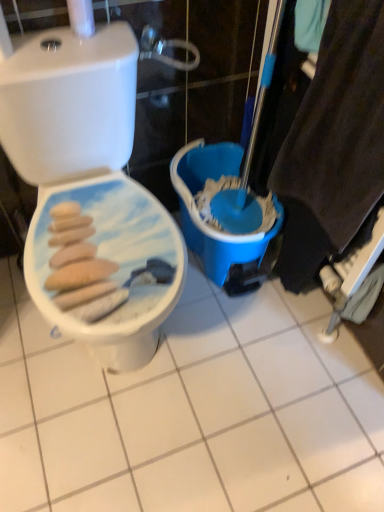
Question: From the image's perspective, is white glossy ceramic tile at center located above or below blue plastic bucket at center?

Choices:
 (A) above
 (B) below

Answer: (B)

Question: Would you say white glossy ceramic tile at center is inside or outside blue plastic bucket at center?

Choices:
 (A) inside
 (B) outside

Answer: (B)

Question: Which is nearer to the white glossy ceramic tile at center?

Choices:
 (A) white glossy toilet seat at left
 (B) blue plastic bucket at center

Answer: (B)

Question: Estimate the real-world distances between objects in this image. Which object is farther from the white glossy toilet seat at left?

Choices:
 (A) white glossy ceramic tile at center
 (B) blue plastic bucket at center

Answer: (A)